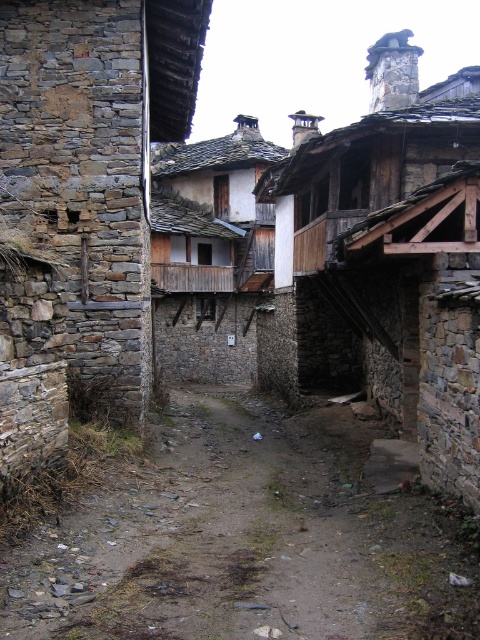
You are a delivery person carrying a heavy box and need to cross the alleyway shown in the image. The alley has both dirt ground at center and wooden planks at center. Which surface should you choose to ensure a more stable footing?

The wooden planks at center should be chosen for a more stable footing because the dirt ground at center has a smaller size compared to the wooden planks at center, making the wooden planks a more substantial surface to walk on.

You are a delivery person with a cart that is 5 feet wide. You need to navigate through the narrow alleyway shown in the image. The alley has a dirt ground at center and wooden planks at center. Can your cart pass through the space between these two features?

The dirt ground at center and wooden planks at center are 50.75 feet apart, which is more than enough space for a 5 feet wide cart to pass through safely.